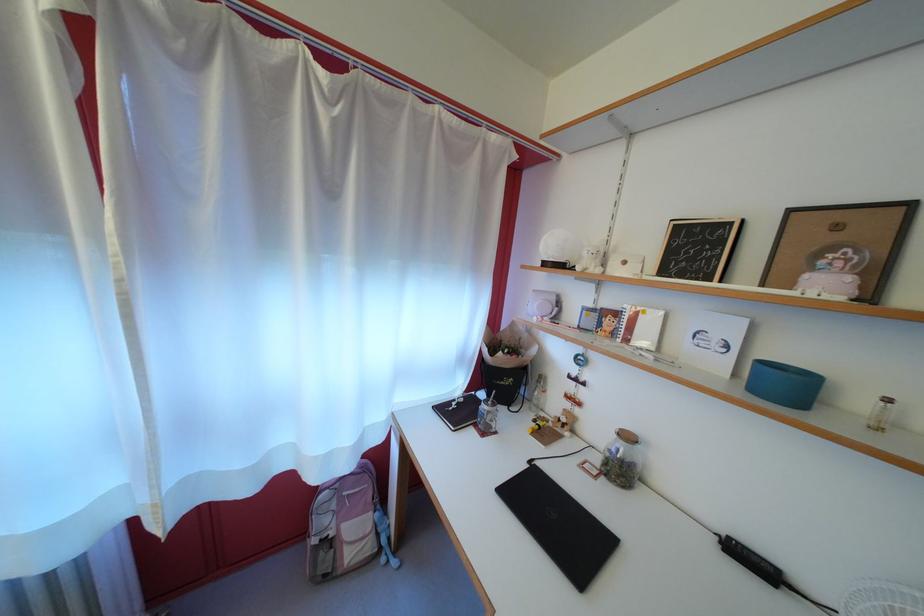
Describe the element at coordinates (626, 436) in the screenshot. I see `the cork jar lid` at that location.